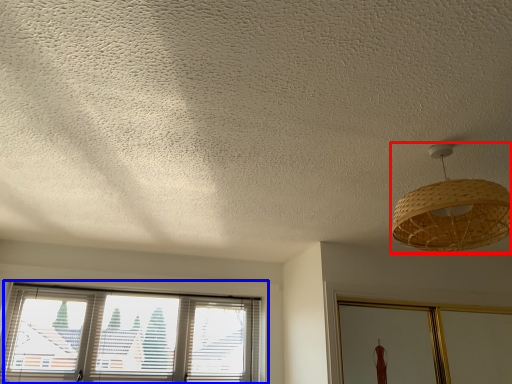
Question: Which object appears farthest to the camera in this image, lamp (highlighted by a red box) or window (highlighted by a blue box)?

Choices:
 (A) lamp
 (B) window

Answer: (B)